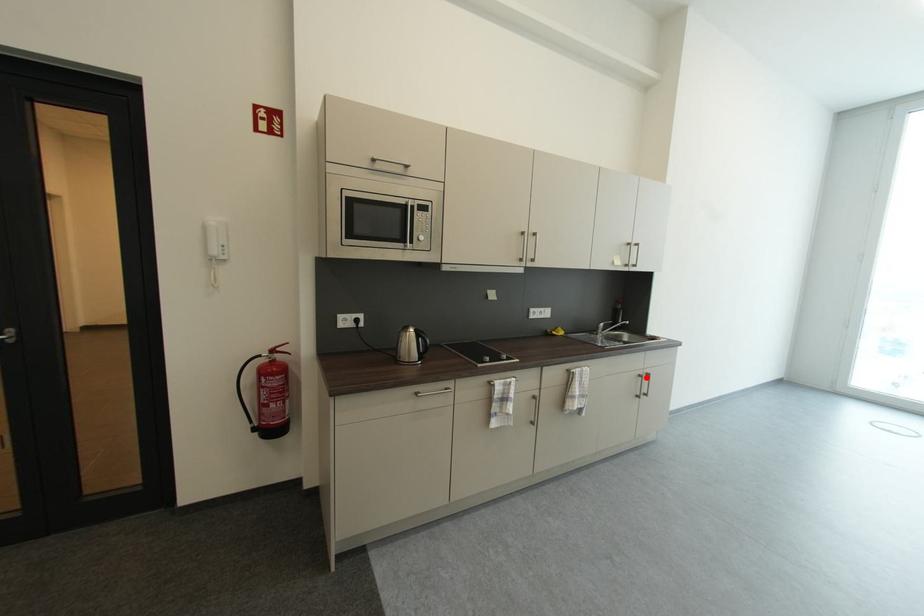
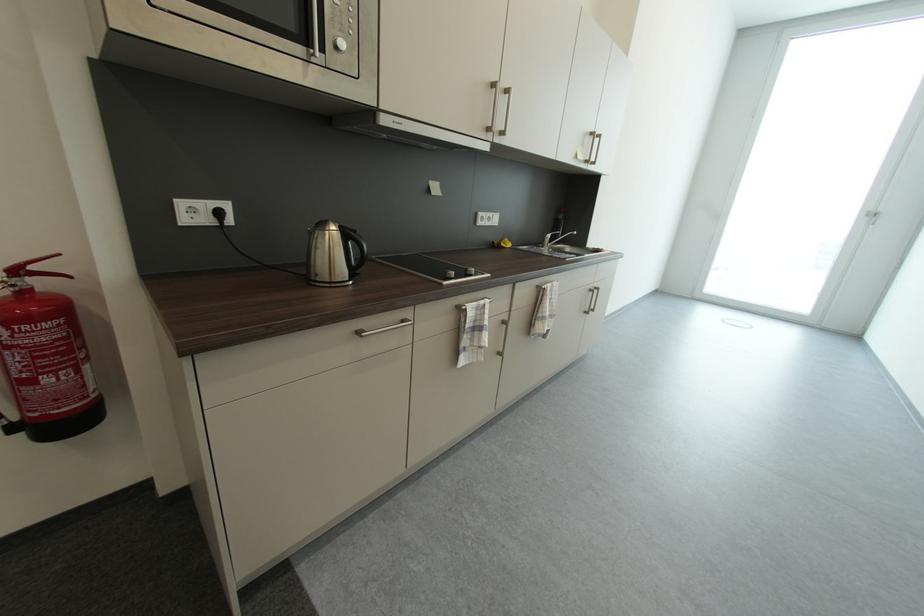
Question: I am providing you with two images of the same scene from different viewpoints. Image1 has a red point marked. In image2, the corresponding 3D location appears at what relative position? Reply with the corresponding letter.

Choices:
 (A) Closer
 (B) Farther

Answer: (A)